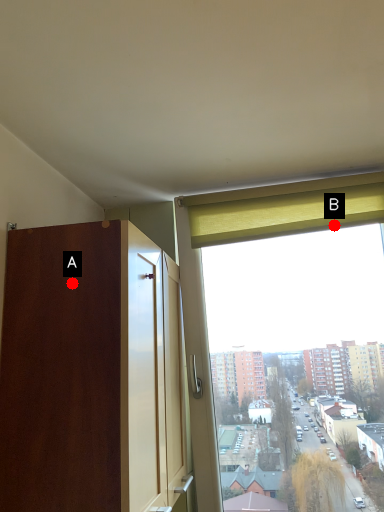
Question: Two points are circled on the image, labeled by A and B beside each circle. Which point is farther from the camera taking this photo?

Choices:
 (A) A is further
 (B) B is further

Answer: (B)